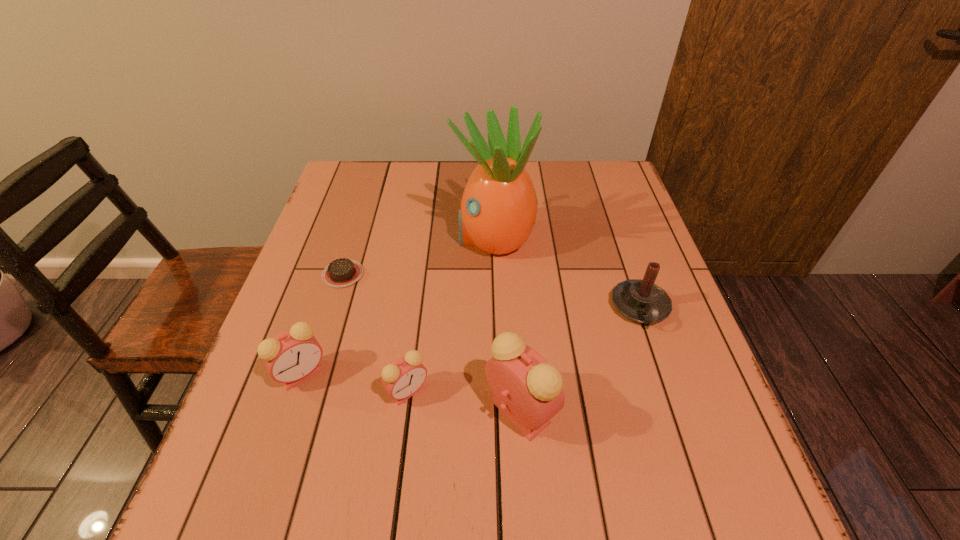
You are a GUI agent. You are given a task and a screenshot of the screen. Output one action in this format:
    pyautogui.click(x=<x>, y=<y>)
    Task: Click on the free point at the far edge
    Image resolution: width=960 pixels, height=540 pixels.
    Given the screenshot: What is the action you would take?
    pyautogui.click(x=432, y=175)

This screenshot has width=960, height=540. Identify the location of free space at the near edge of the desktop. (401, 416).

In the image, there is a desktop. Where is `vacant space at the left edge`? vacant space at the left edge is located at coordinates (309, 400).

This screenshot has height=540, width=960. I want to click on free spot at the right edge of the desktop, so click(636, 278).

In the image, there is a desktop. Find the location of `blank space at the far left corner`. blank space at the far left corner is located at coordinates (341, 166).

Locate an element on the screen. The width and height of the screenshot is (960, 540). free space at the far right corner of the desktop is located at coordinates (618, 184).

In the image, there is a desktop. Identify the location of vacant space at the near right corner. (718, 456).

Identify the location of unoccupied position between the tallest object and the chocolate cake. (418, 255).

At what (x,y) coordinates should I click in order to perform the action: click on free space between the tallest alarm clock and the tallest object. Please return your answer as a coordinate pair (x, y). This screenshot has height=540, width=960. Looking at the image, I should click on (507, 323).

The image size is (960, 540). Identify the location of free spot between the pineapple and the second tallest alarm clock. (397, 305).